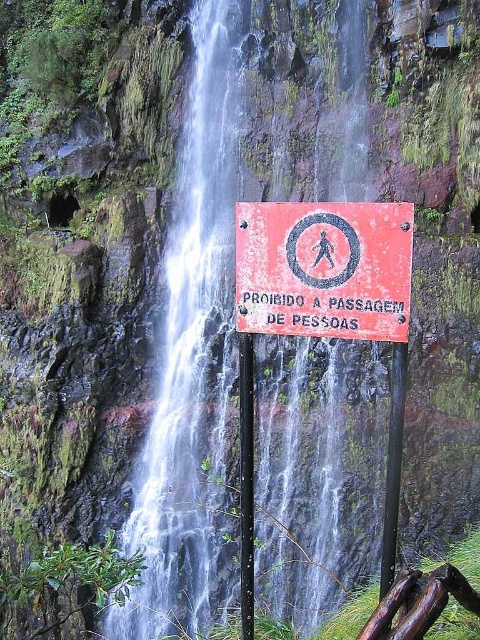
Question: Which point is farther to the camera?

Choices:
 (A) (392, 476)
 (B) (342, 282)
 (C) (247, 499)
 (D) (210, 346)

Answer: (D)

Question: Which point appears closest to the camera in this image?

Choices:
 (A) (308, 355)
 (B) (347, 275)
 (C) (397, 484)

Answer: (B)

Question: Does black plastic pole at center appear over black metal pole at center?

Choices:
 (A) no
 (B) yes

Answer: (B)

Question: Which point is farther to the camera?

Choices:
 (A) black metal pole at center
 (B) smooth rock waterfall at center
 (C) rusty metal sign at center

Answer: (B)

Question: Is black plastic pole at center to the left of black metal pole at center from the viewer's perspective?

Choices:
 (A) yes
 (B) no

Answer: (A)

Question: Observing the image, what is the correct spatial positioning of smooth rock waterfall at center in reference to rusty metal sign at center?

Choices:
 (A) right
 (B) left

Answer: (B)